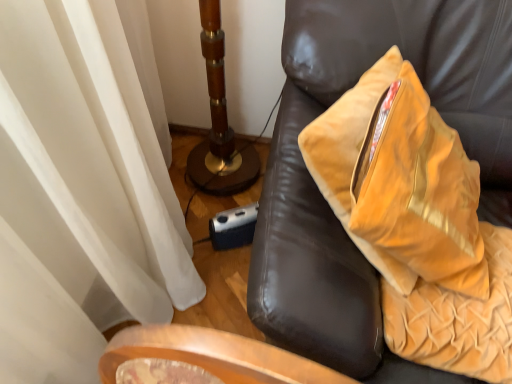
The height and width of the screenshot is (384, 512). Describe the element at coordinates (402, 185) in the screenshot. I see `velvet yellow pillow at right` at that location.

This screenshot has height=384, width=512. In order to click on velvet yellow pillow at right in this screenshot , I will do `click(402, 185)`.

The width and height of the screenshot is (512, 384). Identify the location of velvet yellow pillow at right. (402, 185).